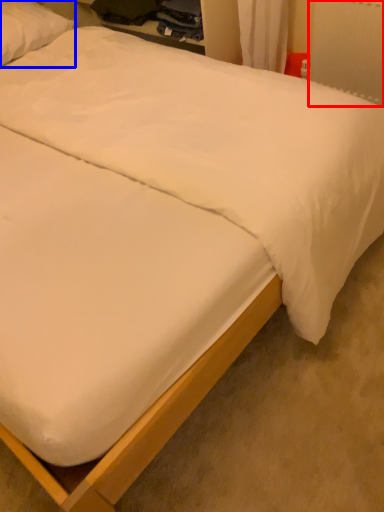
Question: Which object appears farthest to the camera in this image, radiator (highlighted by a red box) or pillow (highlighted by a blue box)?

Choices:
 (A) radiator
 (B) pillow

Answer: (B)